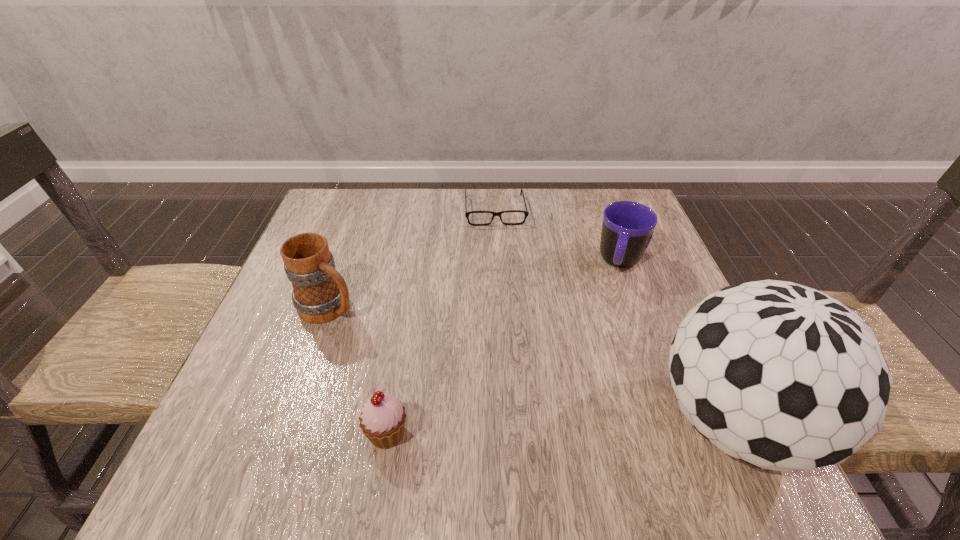
Locate an element on the screen. vacant point located on the side of the left mug with the handle is located at coordinates (438, 369).

Find the location of a particular element. blank space located on the side of the left mug with the handle is located at coordinates (459, 381).

Where is `vacant position located on the side of the left mug with the handle`? The width and height of the screenshot is (960, 540). vacant position located on the side of the left mug with the handle is located at coordinates (370, 328).

In order to click on vacant space located on the front-facing side of the third object from right to left in this screenshot , I will do `click(505, 293)`.

The width and height of the screenshot is (960, 540). I want to click on free spot located 0.170m on the front-facing side of the third object from right to left, so [x=502, y=267].

Where is `vacant region located on the front-facing side of the third object from right to left`? The width and height of the screenshot is (960, 540). vacant region located on the front-facing side of the third object from right to left is located at coordinates (501, 259).

Locate an element on the screen. Image resolution: width=960 pixels, height=540 pixels. blank space located with the handle on the side of the fourth nearest object is located at coordinates (608, 322).

I want to click on vacant space located with the handle on the side of the fourth nearest object, so click(592, 377).

What are the coordinates of `free location located with the handle on the side of the fourth nearest object` in the screenshot? It's located at (579, 427).

Locate an element on the screen. This screenshot has height=540, width=960. object that is at the far edge is located at coordinates (526, 212).